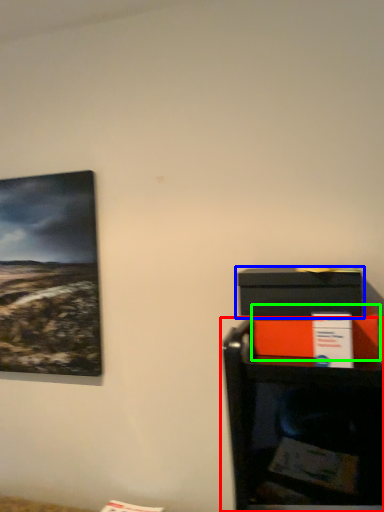
Question: Which object is the farthest from furniture (highlighted by a red box)? Choose among these: box (highlighted by a blue box) or box (highlighted by a green box).

Choices:
 (A) box
 (B) box

Answer: (A)